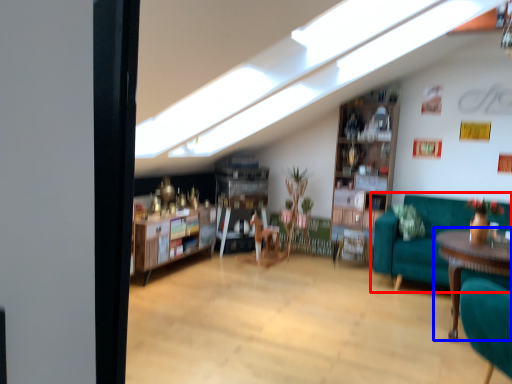
Question: Which object is closer to the camera taking this photo, studio couch (highlighted by a red box) or table (highlighted by a blue box)?

Choices:
 (A) studio couch
 (B) table

Answer: (B)